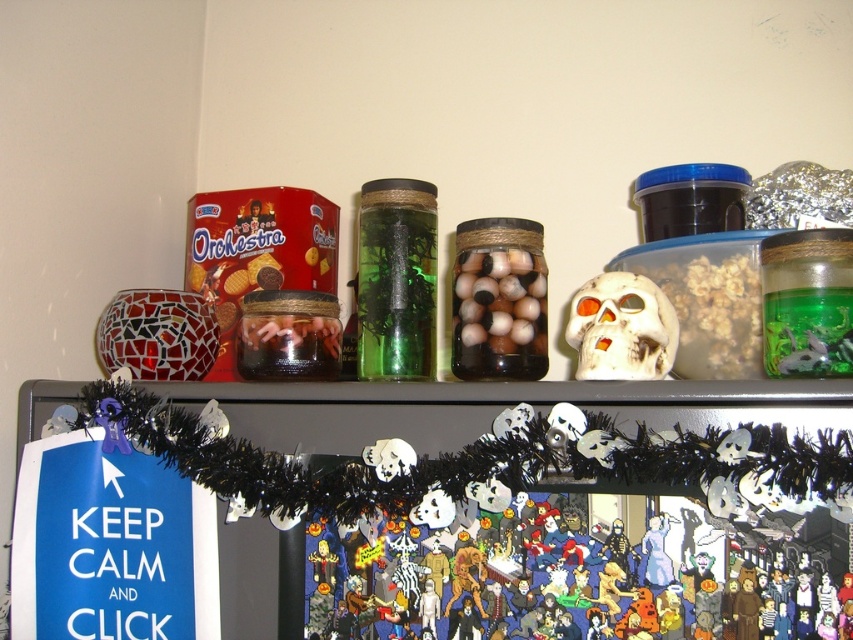
Is transparent glass jar at center taller than white matte skull at center?

Indeed, transparent glass jar at center has a greater height compared to white matte skull at center.

Who is more forward, (399, 365) or (663, 312)?

Point (663, 312)

Find the location of a particular element. The width and height of the screenshot is (853, 640). transparent glass jar at center is located at coordinates (396, 280).

Which is below, white matte skull at center or translucent glass jar filled with marbles at center?

white matte skull at center is lower down.

Is white matte skull at center to the right of translucent glass jar filled with marbles at center from the viewer's perspective?

Correct, you'll find white matte skull at center to the right of translucent glass jar filled with marbles at center.

Who is more distant from viewer, (x=599, y=324) or (x=520, y=333)?

Point (x=520, y=333)

Where is `white matte skull at center`? white matte skull at center is located at coordinates (621, 328).

Who is taller, translucent glass jar filled with marbles at center or translucent glass jar at center?

translucent glass jar filled with marbles at center is taller.

Who is higher up, translucent glass jar filled with marbles at center or translucent glass jar at center?

translucent glass jar filled with marbles at center is above.

This screenshot has width=853, height=640. In order to click on translucent glass jar filled with marbles at center in this screenshot , I will do `click(500, 300)`.